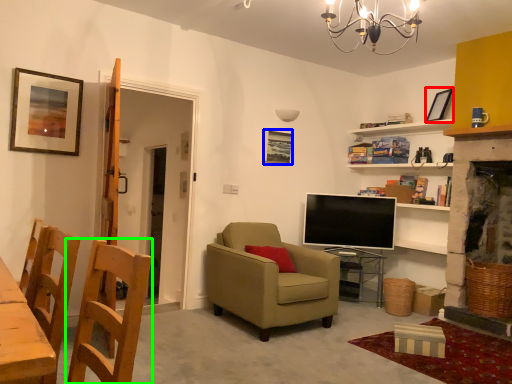
Question: Which is farther away from picture frame (highlighted by a red box)? picture frame (highlighted by a blue box) or chair (highlighted by a green box)?

Choices:
 (A) picture frame
 (B) chair

Answer: (B)